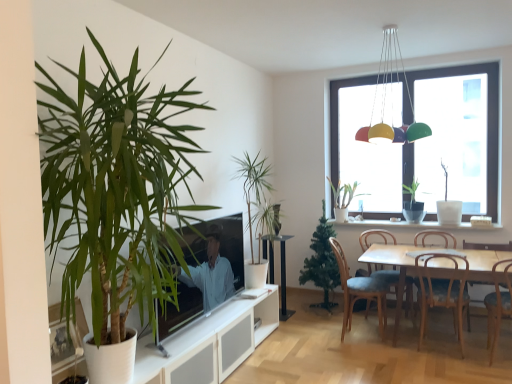
I want to click on vacant position to the left of white glossy table at lower right, so click(x=340, y=347).